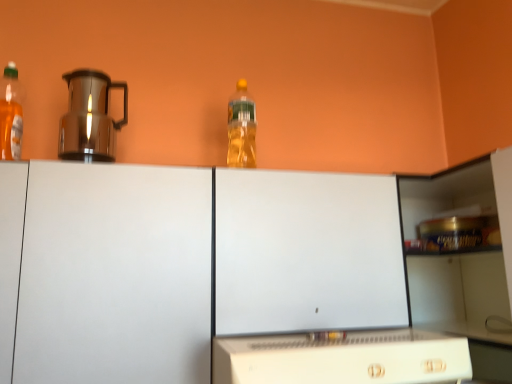
This screenshot has height=384, width=512. What do you see at coordinates (241, 128) in the screenshot? I see `translucent plastic bottle at upper center, placed as the second bottle when sorted from left to right` at bounding box center [241, 128].

Image resolution: width=512 pixels, height=384 pixels. I want to click on translucent plastic bottle at upper center, placed as the 1th bottle when sorted from right to left, so pos(241,128).

In order to face shiny metallic coffee pot at left, should I rotate leftwards or rightwards?

You should rotate left by 20.439 degrees.

Identify the location of shiny metallic coffee pot at left. (90, 117).

Measure the distance between point (16, 119) and camera.

The depth of point (16, 119) is 1.05 meters.

What is the approximate height of translucent plastic bottle at left, the 1th bottle viewed from the front?

translucent plastic bottle at left, the 1th bottle viewed from the front, is 10.56 inches tall.

This screenshot has height=384, width=512. What are the coordinates of `white plastic microwave at lower center` in the screenshot? It's located at (342, 358).

What are the coordinates of `the 2nd bottle to the left of the white plastic microwave at lower center, counting from the anchor's position` in the screenshot? It's located at click(x=11, y=114).

Is translucent plastic bottle at left, the 1th bottle viewed from the front, facing away from white plastic microwave at lower center?

No, translucent plastic bottle at left, the 1th bottle viewed from the front, is not facing the opposite direction of white plastic microwave at lower center.

From the image's perspective, who appears lower, translucent plastic bottle at left, placed as the 1th bottle when sorted from left to right, or white plastic microwave at lower center?

From the image's view, white plastic microwave at lower center is below.

Is translucent plastic bottle at upper center, placed as the second bottle when sorted from left to right, oriented away from white plastic microwave at lower center?

translucent plastic bottle at upper center, placed as the second bottle when sorted from left to right, is not turned away from white plastic microwave at lower center.

Between translucent plastic bottle at upper center, placed as the 1th bottle when sorted from right to left, and white plastic microwave at lower center, which one has smaller size?

translucent plastic bottle at upper center, placed as the 1th bottle when sorted from right to left, is smaller.

The width and height of the screenshot is (512, 384). In order to click on home appliance that is below the translucent plastic bottle at upper center, the second bottle when ordered from front to back (from the image's perspective) in this screenshot , I will do `click(342, 358)`.

From the image's perspective, who appears lower, translucent plastic bottle at upper center, placed as the 1th bottle when sorted from right to left, or white plastic microwave at lower center?

white plastic microwave at lower center is shown below in the image.

Is shiny metallic coffee pot at left positioned far away from translucent plastic bottle at upper center, placed as the 1th bottle when sorted from right to left?

No, shiny metallic coffee pot at left is not far away from translucent plastic bottle at upper center, placed as the 1th bottle when sorted from right to left.

Can you confirm if shiny metallic coffee pot at left is shorter than translucent plastic bottle at upper center, placed as the second bottle when sorted from left to right?

Yes.

Considering the relative sizes of shiny metallic coffee pot at left and translucent plastic bottle at upper center, the second bottle when ordered from front to back, in the image provided, is shiny metallic coffee pot at left bigger than translucent plastic bottle at upper center, the second bottle when ordered from front to back,?

Yes, shiny metallic coffee pot at left is bigger than translucent plastic bottle at upper center, the second bottle when ordered from front to back.

Between point (82, 89) and point (254, 145), which one is positioned in front?

The point (82, 89) is closer to the camera.

Considering their positions, is translucent plastic bottle at left, marked as the second bottle in a back-to-front arrangement, located in front of or behind shiny metallic coffee pot at left?

In the image, translucent plastic bottle at left, marked as the second bottle in a back-to-front arrangement, appears in front of shiny metallic coffee pot at left.

Which is further, (12, 130) or (103, 88)?

Positioned behind is point (103, 88).

From a real-world perspective, who is located lower, translucent plastic bottle at left, arranged as the 2th bottle when viewed from the right, or shiny metallic coffee pot at left?

shiny metallic coffee pot at left is physically lower.

Does translucent plastic bottle at left, marked as the second bottle in a back-to-front arrangement, touch shiny metallic coffee pot at left?

No.

In terms of size, does translucent plastic bottle at left, marked as the second bottle in a back-to-front arrangement, appear bigger or smaller than white matte cabinet at center?

Considering their sizes, translucent plastic bottle at left, marked as the second bottle in a back-to-front arrangement, takes up less space than white matte cabinet at center.

Which is more to the left, translucent plastic bottle at left, arranged as the 2th bottle when viewed from the right, or white matte cabinet at center?

translucent plastic bottle at left, arranged as the 2th bottle when viewed from the right.

Is translucent plastic bottle at left, placed as the 1th bottle when sorted from left to right, wider or thinner than white matte cabinet at center?

In the image, translucent plastic bottle at left, placed as the 1th bottle when sorted from left to right, appears to be more narrow than white matte cabinet at center.

Does point (5, 118) lie in front of point (14, 189)?

No, it is not.

Relative to translucent plastic bottle at left, the 1th bottle viewed from the front, is white matte cabinet at center in front or behind?

Visually, white matte cabinet at center is located in front of translucent plastic bottle at left, the 1th bottle viewed from the front.

Is translucent plastic bottle at left, the 1th bottle viewed from the front, at the back of white matte cabinet at center?

white matte cabinet at center is not turned away from translucent plastic bottle at left, the 1th bottle viewed from the front.

At what (x,y) coordinates should I click in order to perform the action: click on bottle that is on the left side of white matte cabinet at center. Please return your answer as a coordinate pair (x, y). Looking at the image, I should click on (11, 114).

Is point (373, 369) in front of point (13, 111)?

That is True.

Is white plastic microwave at lower center at the right side of translucent plastic bottle at left, the 1th bottle viewed from the front?

Correct, you'll find white plastic microwave at lower center to the right of translucent plastic bottle at left, the 1th bottle viewed from the front.

Looking at the image, does white plastic microwave at lower center seem bigger or smaller compared to translucent plastic bottle at left, the 1th bottle viewed from the front?

In the image, white plastic microwave at lower center appears to be larger than translucent plastic bottle at left, the 1th bottle viewed from the front.

You are a GUI agent. You are given a task and a screenshot of the screen. Output one action in this format:
    pyautogui.click(x=<x>, y=<y>)
    Task: Click on the home appliance that appears below the translucent plastic bottle at left, placed as the 1th bottle when sorted from left to right (from the image's perspective)
    
    Given the screenshot: What is the action you would take?
    pyautogui.click(x=342, y=358)

This screenshot has width=512, height=384. What are the coordinates of `the 1st bottle above when counting from the white plastic microwave at lower center (from the image's perspective)` in the screenshot? It's located at (241, 128).

Estimate the real-world distances between objects in this image. Which object is further from white plastic microwave at lower center, translucent plastic bottle at left, arranged as the 2th bottle when viewed from the right, or translucent plastic bottle at upper center, placed as the 1th bottle when sorted from right to left?

Based on the image, translucent plastic bottle at left, arranged as the 2th bottle when viewed from the right, appears to be further to white plastic microwave at lower center.

Based on their spatial positions, is translucent plastic bottle at upper center, placed as the second bottle when sorted from left to right, or shiny metallic coffee pot at left further from white plastic microwave at lower center?

shiny metallic coffee pot at left lies further to white plastic microwave at lower center than the other object.

Estimate the real-world distances between objects in this image. Which object is further from translucent plastic bottle at upper center, the first bottle viewed from the back, white matte cabinet at center or translucent plastic bottle at left, placed as the 1th bottle when sorted from left to right?

Among the two, translucent plastic bottle at left, placed as the 1th bottle when sorted from left to right, is located further to translucent plastic bottle at upper center, the first bottle viewed from the back.

Estimate the real-world distances between objects in this image. Which object is further from translucent plastic bottle at left, the 1th bottle viewed from the front, shiny metallic coffee pot at left or translucent plastic bottle at upper center, the second bottle when ordered from front to back?

The object further to translucent plastic bottle at left, the 1th bottle viewed from the front, is translucent plastic bottle at upper center, the second bottle when ordered from front to back.

Looking at the image, which one is located closer to translucent plastic bottle at upper center, placed as the 1th bottle when sorted from right to left, translucent plastic bottle at left, marked as the second bottle in a back-to-front arrangement, or white matte cabinet at center?

Among the two, white matte cabinet at center is located nearer to translucent plastic bottle at upper center, placed as the 1th bottle when sorted from right to left.

Looking at the image, which one is located closer to translucent plastic bottle at left, marked as the second bottle in a back-to-front arrangement, shiny metallic coffee pot at left or white plastic microwave at lower center?

Among the two, shiny metallic coffee pot at left is located nearer to translucent plastic bottle at left, marked as the second bottle in a back-to-front arrangement.

In the scene shown: Which object lies nearer to the anchor point translucent plastic bottle at left, placed as the 1th bottle when sorted from left to right, white plastic microwave at lower center or white matte cabinet at center?

white matte cabinet at center lies closer to translucent plastic bottle at left, placed as the 1th bottle when sorted from left to right, than the other object.

Which object lies nearer to the anchor point white plastic microwave at lower center, white matte cabinet at center or translucent plastic bottle at left, arranged as the 2th bottle when viewed from the right?

Based on the image, white matte cabinet at center appears to be nearer to white plastic microwave at lower center.

Locate an element on the screen. The height and width of the screenshot is (384, 512). kitchen appliance between translucent plastic bottle at upper center, the second bottle when ordered from front to back, and white matte cabinet at center vertically is located at coordinates (90, 117).

This screenshot has width=512, height=384. I want to click on cabinetry located between translucent plastic bottle at left, the 1th bottle viewed from the front, and white plastic microwave at lower center in the left-right direction, so click(246, 275).

Find the location of a particular element. bottle situated between translucent plastic bottle at left, the 1th bottle viewed from the front, and white plastic microwave at lower center from left to right is located at coordinates (241, 128).

I want to click on kitchen appliance between translucent plastic bottle at left, placed as the 1th bottle when sorted from left to right, and white matte cabinet at center from top to bottom, so click(90, 117).